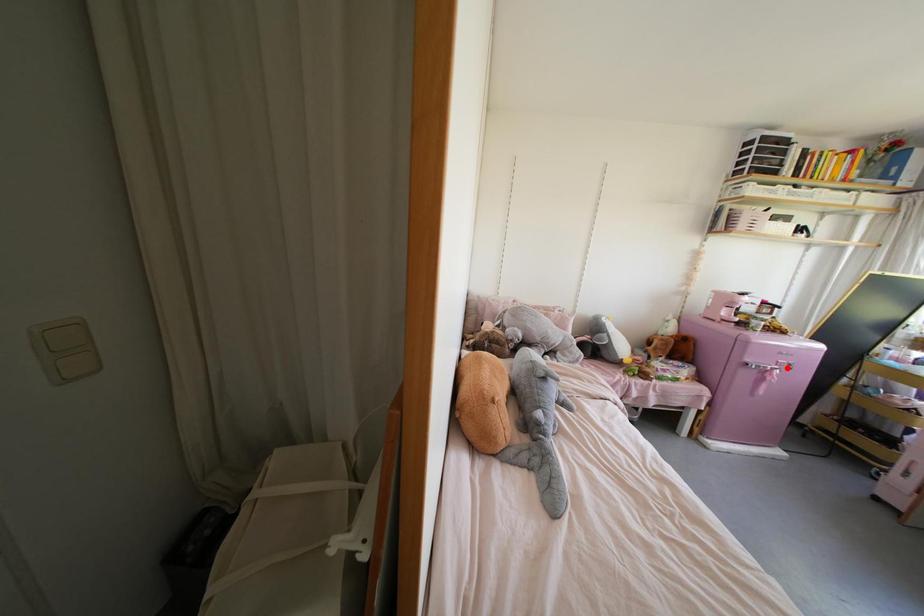
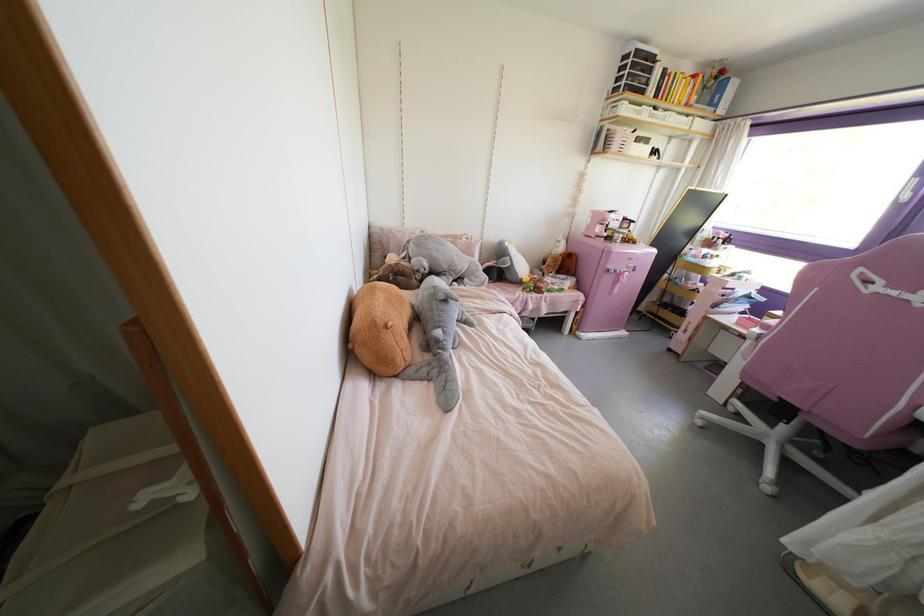
The point at the highlighted location is marked in the first image. Where is the corresponding point in the second image?

(633, 270)